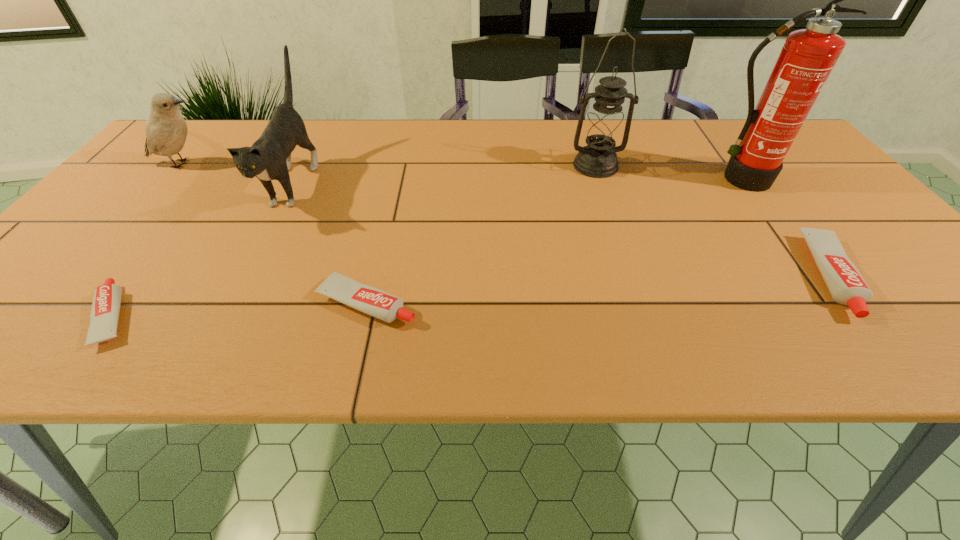
The height and width of the screenshot is (540, 960). I want to click on the shortest toothpaste, so click(105, 309).

The image size is (960, 540). I want to click on the shortest object, so click(x=105, y=309).

Identify the location of the fourth object from left to right. This screenshot has height=540, width=960. (377, 303).

The height and width of the screenshot is (540, 960). Find the location of `the second toothpaste from left to right`. the second toothpaste from left to right is located at coordinates (377, 303).

Find the location of a particular element. Image resolution: width=960 pixels, height=540 pixels. the tallest toothpaste is located at coordinates (846, 285).

Locate an element on the screen. The image size is (960, 540). the rightmost toothpaste is located at coordinates (846, 285).

At what (x,y) coordinates should I click in order to perform the action: click on bird. Please return your answer as a coordinate pair (x, y). The image size is (960, 540). Looking at the image, I should click on (166, 130).

Locate an element on the screen. fire extinguisher is located at coordinates (808, 56).

At what (x,y) coordinates should I click in order to perform the action: click on cat. Please return your answer as a coordinate pair (x, y). Looking at the image, I should click on (269, 158).

Image resolution: width=960 pixels, height=540 pixels. Find the location of `the fifth shortest object`. the fifth shortest object is located at coordinates (269, 158).